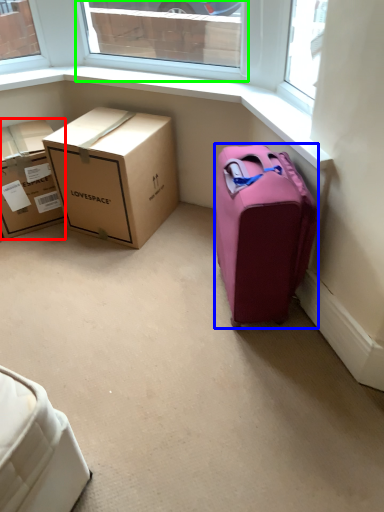
Question: Which object is the closest to the box (highlighted by a red box)? Choose among these: suitcase (highlighted by a blue box) or window (highlighted by a green box).

Choices:
 (A) suitcase
 (B) window

Answer: (A)